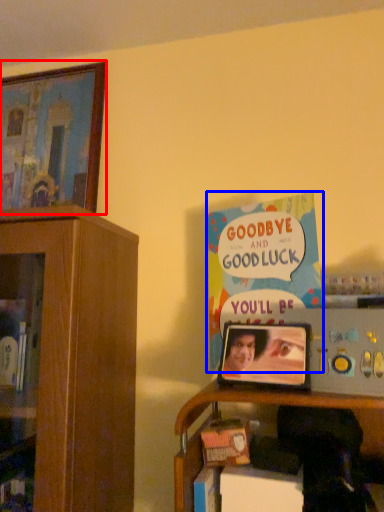
Question: Which object is further to the camera taking this photo, picture frame (highlighted by a red box) or book (highlighted by a blue box)?

Choices:
 (A) picture frame
 (B) book

Answer: (A)